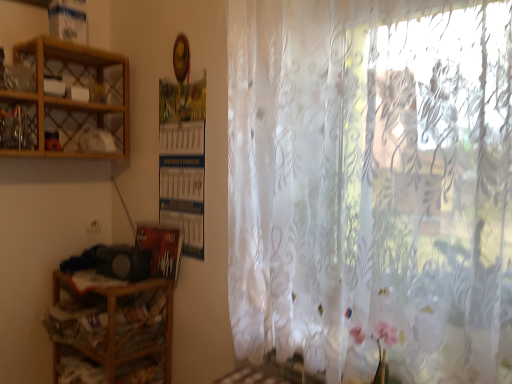
Question: In terms of height, does wooden at left, the 2th shelf from the top, look taller or shorter compared to wooden cabinet at upper left?

Choices:
 (A) tall
 (B) short

Answer: (A)

Question: From a real-world perspective, is wooden at left, the 2th shelf from the top, physically located above or below wooden cabinet at upper left?

Choices:
 (A) above
 (B) below

Answer: (B)

Question: Which of these objects is positioned farthest from the translucent floral-patterned curtain at right?

Choices:
 (A) woodenobject at upper left, the first shelf viewed from the top
 (B) wooden at left, the 2th shelf from the top
 (C) wooden cabinet at upper left

Answer: (C)

Question: Which is nearer to the wooden cabinet at upper left?

Choices:
 (A) translucent floral-patterned curtain at right
 (B) wooden at left, which is the first shelf from bottom to top
 (C) woodenobject at upper left, the first shelf viewed from the top

Answer: (C)